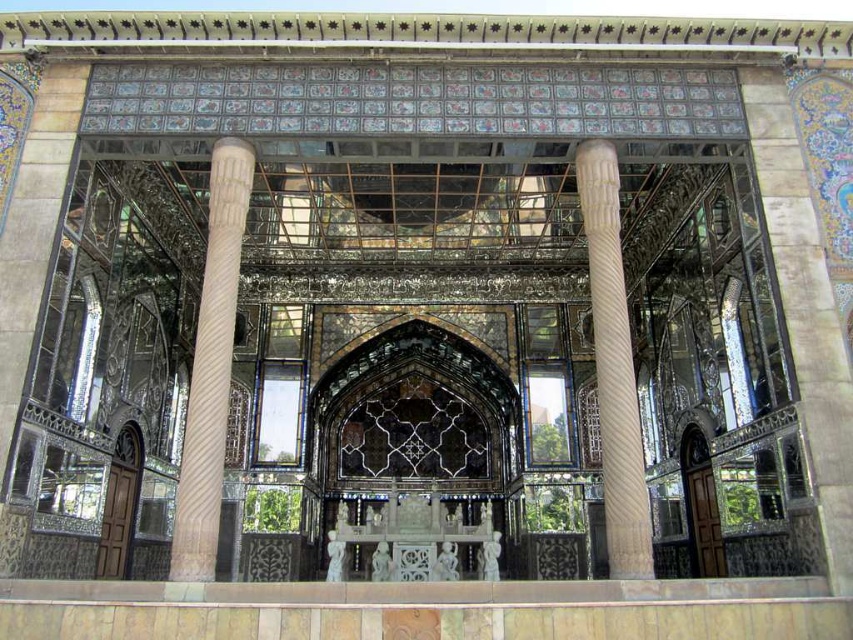
Question: Does white marble column at center appear on the right side of carved stone column at center?

Choices:
 (A) yes
 (B) no

Answer: (B)

Question: Is white marble column at center below carved stone column at center?

Choices:
 (A) yes
 (B) no

Answer: (B)

Question: Which point is farther to the camera?

Choices:
 (A) white marble column at center
 (B) carved stone column at center

Answer: (B)

Question: Can you confirm if white marble column at center is positioned above carved stone column at center?

Choices:
 (A) yes
 (B) no

Answer: (A)

Question: Which of the following is the farthest from the observer?

Choices:
 (A) carved stone column at center
 (B) white marble column at center

Answer: (A)

Question: Which of the following is the farthest from the observer?

Choices:
 (A) white marble column at center
 (B) carved stone column at center

Answer: (B)